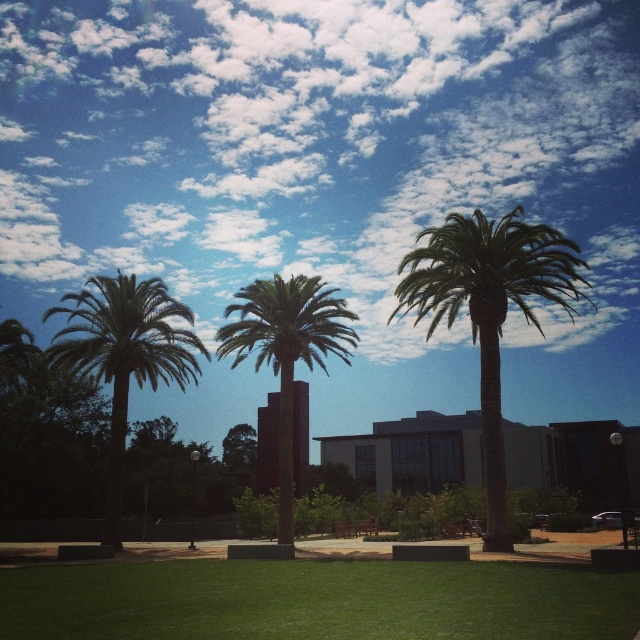
Question: Can you confirm if green leafy palm at center is positioned to the left of black glass tower at center?

Choices:
 (A) no
 (B) yes

Answer: (A)

Question: Which object is closer to the camera taking this photo?

Choices:
 (A) green leafy palm tree at center
 (B) green grass at center
 (C) green leafy palm tree at left

Answer: (B)

Question: Does green leafy palm tree at left have a smaller size compared to green leafy palm tree at center?

Choices:
 (A) no
 (B) yes

Answer: (B)

Question: Can you confirm if white fluffy cloud at upper center is thinner than black glass tower at center?

Choices:
 (A) yes
 (B) no

Answer: (B)

Question: Which of the following is the farthest from the observer?

Choices:
 (A) green leafy palm tree at center
 (B) green leafy palm tree at left

Answer: (B)

Question: Which object is farther from the camera taking this photo?

Choices:
 (A) green leafy palm at center
 (B) green grass at center

Answer: (A)